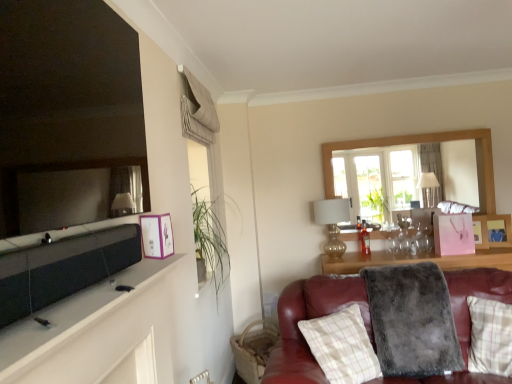
Question: Is wooden photo frame at upper right, marked as the first picture frame in a right-to-left arrangement, located outside plaid fabric pillow at lower right, the second pillow positioned from the left?

Choices:
 (A) no
 (B) yes

Answer: (B)

Question: Is wooden photo frame at upper right, the second picture frame in the front-to-back sequence, at the left side of plaid fabric pillow at lower right, acting as the first pillow starting from the right?

Choices:
 (A) yes
 (B) no

Answer: (B)

Question: Can you confirm if wooden photo frame at upper right, placed as the 2th picture frame when sorted from left to right, is thinner than plaid fabric pillow at lower right, acting as the first pillow starting from the right?

Choices:
 (A) yes
 (B) no

Answer: (A)

Question: From a real-world perspective, does wooden photo frame at upper right, marked as the first picture frame in a right-to-left arrangement, sit lower than plaid fabric pillow at lower right, acting as the first pillow starting from the right?

Choices:
 (A) yes
 (B) no

Answer: (B)

Question: Is wooden photo frame at upper right, placed as the 2th picture frame when sorted from left to right, taller than plaid fabric pillow at lower right, the second pillow positioned from the left?

Choices:
 (A) no
 (B) yes

Answer: (A)

Question: Could you tell me if wooden photo frame at upper right, the second picture frame in the front-to-back sequence, is facing plaid fabric pillow at lower right, acting as the first pillow starting from the right?

Choices:
 (A) yes
 (B) no

Answer: (A)

Question: Can you confirm if plaid fabric pillow at lower right, which is the first pillow in left-to-right order, is taller than brown woven basket at lower right?

Choices:
 (A) no
 (B) yes

Answer: (B)

Question: Is the position of plaid fabric pillow at lower right, which is the first pillow in left-to-right order, less distant than that of brown woven basket at lower right?

Choices:
 (A) no
 (B) yes

Answer: (B)

Question: From the image's perspective, is plaid fabric pillow at lower right, the 2th pillow viewed from the right, over brown woven basket at lower right?

Choices:
 (A) no
 (B) yes

Answer: (B)

Question: Is plaid fabric pillow at lower right, the 2th pillow viewed from the right, completely or partially outside of brown woven basket at lower right?

Choices:
 (A) yes
 (B) no

Answer: (A)

Question: Is plaid fabric pillow at lower right, which is the first pillow in left-to-right order, far from brown woven basket at lower right?

Choices:
 (A) no
 (B) yes

Answer: (B)

Question: Is brown woven basket at lower right at the back of plaid fabric pillow at lower right, which is the first pillow in left-to-right order?

Choices:
 (A) yes
 (B) no

Answer: (A)

Question: From a real-world perspective, is purple paper picture frame at upper left, which appears as the first picture frame when viewed from the left, physically below matte black mirror at upper left?

Choices:
 (A) no
 (B) yes

Answer: (B)